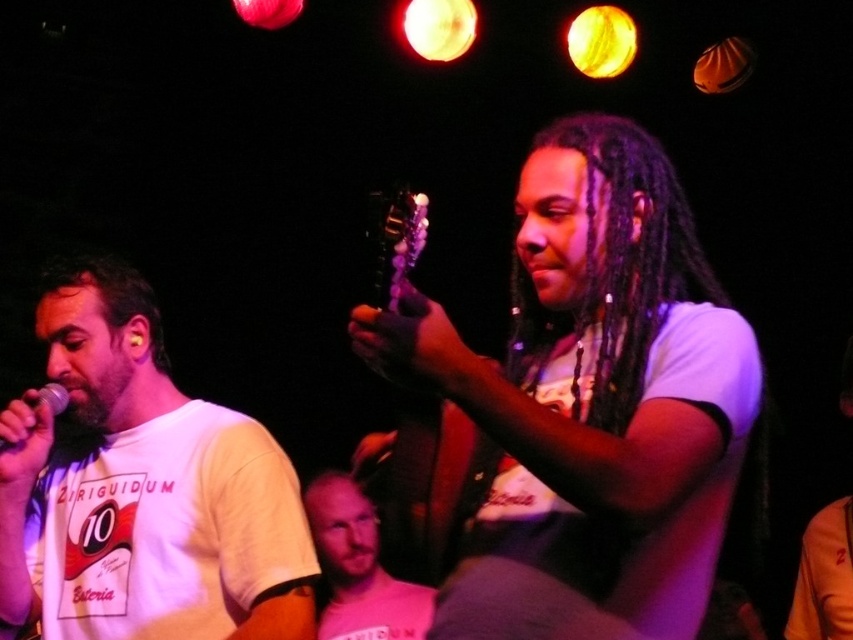
Which of these two, smooth white shirt at center or metallic silver microphone at left, stands taller?

Standing taller between the two is smooth white shirt at center.

Is smooth white shirt at center to the right of metallic silver microphone at left from the viewer's perspective?

Indeed, smooth white shirt at center is positioned on the right side of metallic silver microphone at left.

Which is in front, point (409, 632) or point (64, 404)?

Point (64, 404) is in front.

Where is `smooth white shirt at center`? This screenshot has height=640, width=853. smooth white shirt at center is located at coordinates (358, 566).

Is white cotton t-shirt at left taller than smooth white shirt at center?

Yes, white cotton t-shirt at left is taller than smooth white shirt at center.

Can you confirm if white cotton t-shirt at left is positioned above smooth white shirt at center?

Yes, white cotton t-shirt at left is above smooth white shirt at center.

Between point (254, 566) and point (354, 509), which one is positioned in front?

Positioned in front is point (254, 566).

Locate an element on the screen. The height and width of the screenshot is (640, 853). white cotton t-shirt at left is located at coordinates (143, 488).

Between white cotton t-shirt at left and purple glossy guitar at center, which one has less height?

purple glossy guitar at center is shorter.

Is point (173, 579) closer to camera compared to point (444, 422)?

That is False.

You are a GUI agent. You are given a task and a screenshot of the screen. Output one action in this format:
    pyautogui.click(x=<x>, y=<y>)
    Task: Click on the white cotton t-shirt at left
    
    Given the screenshot: What is the action you would take?
    143,488

Locate an element on the screen. The image size is (853, 640). white cotton t-shirt at left is located at coordinates (143, 488).